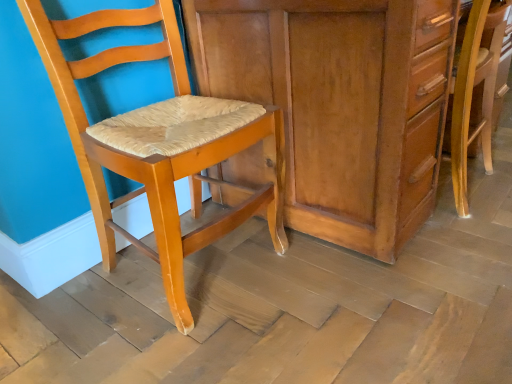
Question: Could you tell me if matte wood cabinet at center is facing matte wood chair at left, the 1th chair when ordered from left to right?

Choices:
 (A) no
 (B) yes

Answer: (A)

Question: Is matte wood cabinet at center turned away from matte wood chair at left, the 1th chair when ordered from left to right?

Choices:
 (A) no
 (B) yes

Answer: (A)

Question: Is matte wood cabinet at center completely or partially outside of matte wood chair at left, the 1th chair when ordered from left to right?

Choices:
 (A) yes
 (B) no

Answer: (A)

Question: Can you confirm if matte wood cabinet at center is thinner than matte wood chair at left, positioned as the second chair in right-to-left order?

Choices:
 (A) no
 (B) yes

Answer: (A)

Question: Can you confirm if matte wood cabinet at center is shorter than matte wood chair at left, the 1th chair when ordered from left to right?

Choices:
 (A) yes
 (B) no

Answer: (A)

Question: From a real-world perspective, is matte wood chair at left, the 1th chair when ordered from left to right, positioned above or below wooden chair at right, acting as the 2th chair starting from the left?

Choices:
 (A) above
 (B) below

Answer: (A)

Question: Considering the positions of matte wood chair at left, the 1th chair when ordered from left to right, and wooden chair at right, acting as the 2th chair starting from the left, in the image, is matte wood chair at left, the 1th chair when ordered from left to right, taller or shorter than wooden chair at right, acting as the 2th chair starting from the left,?

Choices:
 (A) tall
 (B) short

Answer: (A)

Question: Choose the correct answer: Is matte wood chair at left, positioned as the second chair in right-to-left order, inside wooden chair at right, the first chair in the right-to-left sequence, or outside it?

Choices:
 (A) outside
 (B) inside

Answer: (A)

Question: Considering the positions of point (199, 152) and point (488, 89), is point (199, 152) closer or farther from the camera than point (488, 89)?

Choices:
 (A) closer
 (B) farther

Answer: (A)

Question: Do you think matte wood cabinet at center is within wooden chair at right, the first chair in the right-to-left sequence, or outside of it?

Choices:
 (A) outside
 (B) inside

Answer: (A)

Question: Based on their positions, is matte wood cabinet at center located to the left or right of wooden chair at right, acting as the 2th chair starting from the left?

Choices:
 (A) left
 (B) right

Answer: (A)

Question: In terms of size, does matte wood cabinet at center appear bigger or smaller than wooden chair at right, the first chair in the right-to-left sequence?

Choices:
 (A) small
 (B) big

Answer: (B)

Question: From the image's perspective, is matte wood cabinet at center located above or below wooden chair at right, acting as the 2th chair starting from the left?

Choices:
 (A) below
 (B) above

Answer: (B)

Question: In terms of height, does matte wood chair at left, positioned as the second chair in right-to-left order, look taller or shorter compared to matte wood cabinet at center?

Choices:
 (A) short
 (B) tall

Answer: (B)

Question: In terms of width, does matte wood chair at left, positioned as the second chair in right-to-left order, look wider or thinner when compared to matte wood cabinet at center?

Choices:
 (A) wide
 (B) thin

Answer: (B)